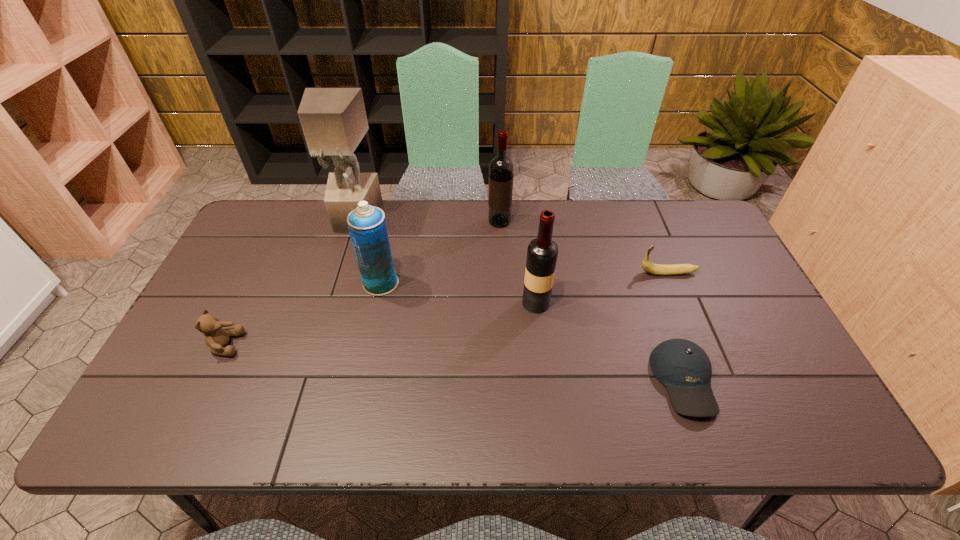
Locate an element on the screen. vacant space located on the left of the farther wine bottle is located at coordinates (413, 221).

The height and width of the screenshot is (540, 960). What are the coordinates of `free space located 0.360m on the right of the third object from right to left` in the screenshot? It's located at 680,303.

At what (x,y) coordinates should I click in order to perform the action: click on vacant region located on the left of the aerosol can. Please return your answer as a coordinate pair (x, y). Looking at the image, I should click on (300, 283).

This screenshot has height=540, width=960. In order to click on vacant space located on the front-facing side of the teddy bear in this screenshot , I will do [304, 345].

The image size is (960, 540). In order to click on vacant region located 0.050m at the stem of the banana in this screenshot , I will do `click(621, 273)`.

The width and height of the screenshot is (960, 540). I want to click on blank space located 0.340m at the stem of the banana, so click(523, 273).

This screenshot has width=960, height=540. Find the location of `vacant space located at the stem of the banana`. vacant space located at the stem of the banana is located at coordinates (570, 273).

Locate an element on the screen. sculpture located at the far edge is located at coordinates (334, 121).

Find the location of a particular element. wine bottle positioned at the far edge is located at coordinates (501, 168).

Find the location of a particular element. This screenshot has width=960, height=540. object present at the near edge is located at coordinates (684, 368).